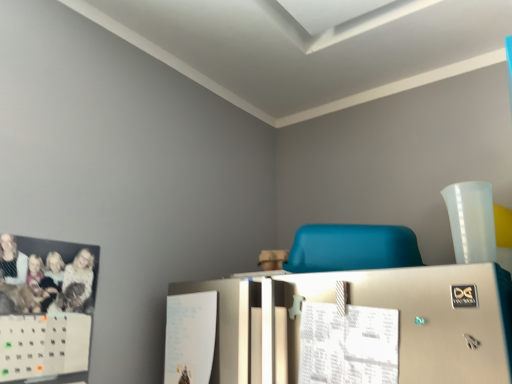
Question: Choose the correct answer: Is blue matte chair at center inside white paper at center or outside it?

Choices:
 (A) inside
 (B) outside

Answer: (B)

Question: From the image's perspective, relative to white paper at center, is blue matte chair at center above or below?

Choices:
 (A) below
 (B) above

Answer: (B)

Question: Is blue matte chair at center in front of or behind white paper at center in the image?

Choices:
 (A) front
 (B) behind

Answer: (B)

Question: Is white paper at center spatially inside blue matte chair at center, or outside of it?

Choices:
 (A) inside
 (B) outside

Answer: (B)

Question: In the image, is white paper at center on the left side or the right side of blue matte chair at center?

Choices:
 (A) right
 (B) left

Answer: (B)

Question: Does point (379, 319) appear closer or farther from the camera than point (309, 240)?

Choices:
 (A) farther
 (B) closer

Answer: (B)

Question: Considering the positions of white paper at center and blue matte chair at center in the image, is white paper at center bigger or smaller than blue matte chair at center?

Choices:
 (A) big
 (B) small

Answer: (B)